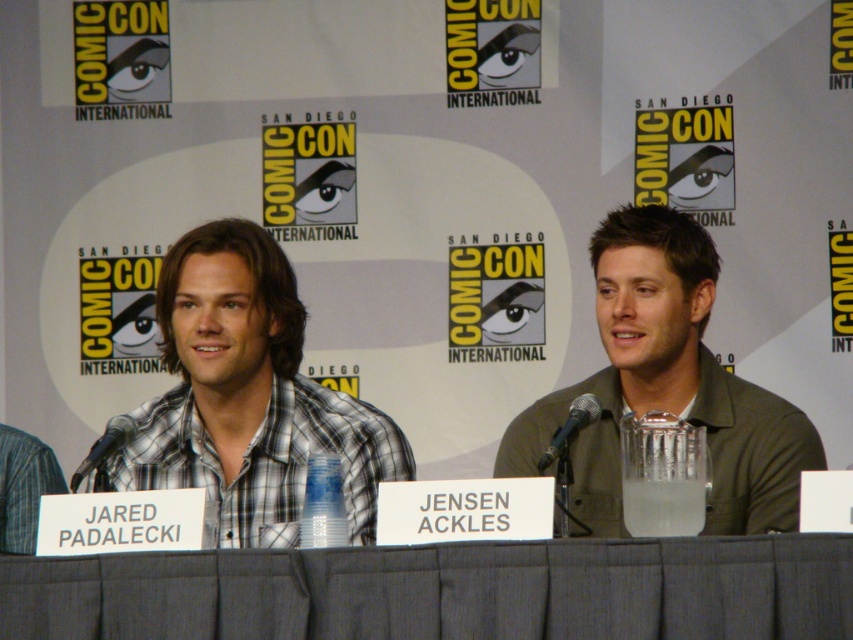
You are an attendee at Comic Con and you want to take a photo of the gray fabric table at center and the green matte shirt at center. Which one should you focus on first to ensure it is in the foreground of your photo?

The gray fabric table at center is in front of the green matte shirt at center, so you should focus on the gray fabric table at center first to ensure it is in the foreground of your photo.

You are a photographer standing behind the audience at Comic Con. You want to take a photo of the two panelists, plaid cotton shirt at left and green matte shirt at center. The camera you are using has a minimum focus distance of 18 inches. Will you be able to capture both of them clearly in the photo?

The distance between plaid cotton shirt at left and green matte shirt at center is 17.84 inches, which is slightly less than the camera minimum focus distance of 18 inches. Therefore, you might not be able to capture both clearly in the photo.

You are an attendee at Comic Con and you want to know if you can place a small notebook on the gray fabric table at center without it being hidden by the plaid cotton shirt at left. Can you do that?

The gray fabric table at center is not as tall as the plaid cotton shirt at left, so placing the notebook there might cause it to be partially hidden by the shirt.